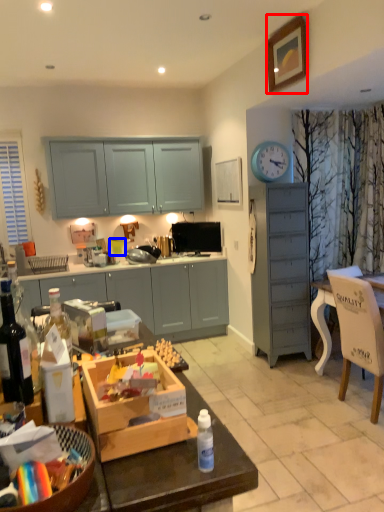
Question: Which of the following is the farthest to the observer, picture frame (highlighted by a red box) or coffee cup (highlighted by a blue box)?

Choices:
 (A) picture frame
 (B) coffee cup

Answer: (B)